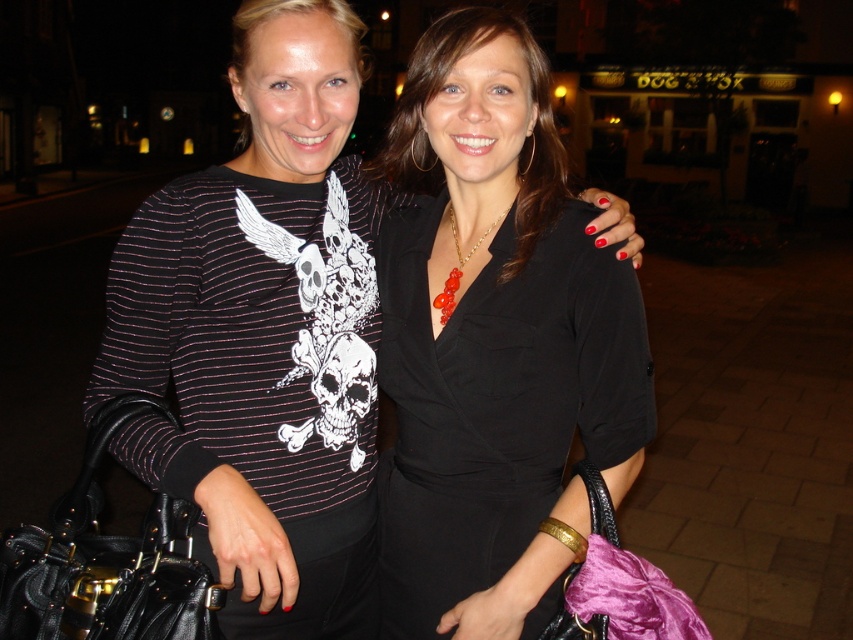
In the scene shown: Is black satin dress at center closer to the viewer compared to velvet purple bag at lower right?

No, black satin dress at center is further to the viewer.

Between point (496, 422) and point (601, 545), which one is positioned behind?

Point (496, 422)

Is point (558, 436) more distant than point (572, 612)?

Yes.

Locate an element on the screen. This screenshot has width=853, height=640. black satin dress at center is located at coordinates (496, 403).

Looking at this image, which is above, black leather handbag at left or velvet purple bag at lower right?

black leather handbag at left is above.

Which of these two, black leather handbag at left or velvet purple bag at lower right, stands taller?

black leather handbag at left

Is point (183, 554) positioned behind point (662, 612)?

Yes.

Where is `black leather handbag at left`? The image size is (853, 640). black leather handbag at left is located at coordinates (106, 561).

Based on the photo, does striped jersey shirt at left have a greater width compared to black leather handbag at left?

Yes.

Identify the location of striped jersey shirt at left. Image resolution: width=853 pixels, height=640 pixels. (258, 371).